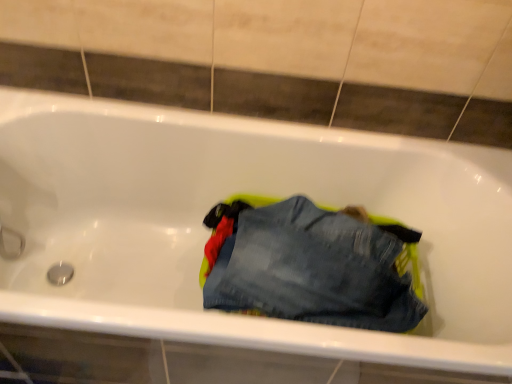
What do you see at coordinates (313, 267) in the screenshot?
I see `denim at center` at bounding box center [313, 267].

What is the approximate width of denim at center?

43.99 centimeters.

This screenshot has width=512, height=384. I want to click on denim at center, so click(x=313, y=267).

Identify the location of denim at center. The width and height of the screenshot is (512, 384). (313, 267).